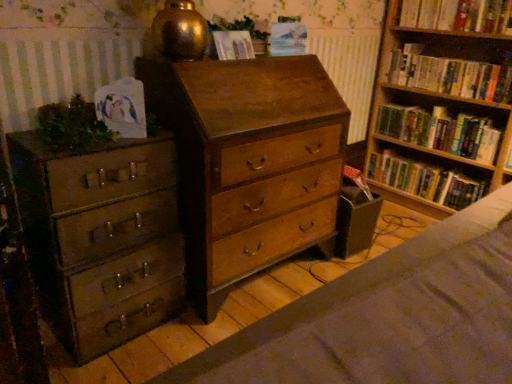
Question: Can you confirm if wooden bookshelf at right, which ranks as the third book in top-to-bottom order, is positioned to the right of green matte plant at left, arranged as the 1th plant when ordered from the bottom?

Choices:
 (A) yes
 (B) no

Answer: (A)

Question: Are wooden bookshelf at right, which ranks as the third book in top-to-bottom order, and green matte plant at left, positioned as the 1th plant in front-to-back order, making contact?

Choices:
 (A) no
 (B) yes

Answer: (A)

Question: Can you confirm if wooden bookshelf at right, which ranks as the third book in top-to-bottom order, is wider than green matte plant at left, marked as the second plant in a top-to-bottom arrangement?

Choices:
 (A) yes
 (B) no

Answer: (A)

Question: Would you say wooden bookshelf at right, the 2th book in the bottom-to-top sequence, contains green matte plant at left, arranged as the second plant when viewed from the back?

Choices:
 (A) yes
 (B) no

Answer: (B)

Question: Is wooden bookshelf at right, which ranks as the third book in top-to-bottom order, not inside green matte plant at left, marked as the second plant in a top-to-bottom arrangement?

Choices:
 (A) yes
 (B) no

Answer: (A)

Question: Considering the relative positions of wooden bookshelf at right, which ranks as the third book in top-to-bottom order, and matte green metal chest of drawers at left, the 2th chest of drawers when ordered from right to left, in the image provided, is wooden bookshelf at right, which ranks as the third book in top-to-bottom order, to the left or to the right of matte green metal chest of drawers at left, the 2th chest of drawers when ordered from right to left,?

Choices:
 (A) left
 (B) right

Answer: (B)

Question: From the image's perspective, relative to matte green metal chest of drawers at left, the 1th chest of drawers in the left-to-right sequence, is wooden bookshelf at right, the 2th book in the bottom-to-top sequence, above or below?

Choices:
 (A) below
 (B) above

Answer: (B)

Question: From their relative heights in the image, would you say wooden bookshelf at right, the 2th book in the bottom-to-top sequence, is taller or shorter than matte green metal chest of drawers at left, the 1th chest of drawers in the left-to-right sequence?

Choices:
 (A) tall
 (B) short

Answer: (B)

Question: Would you say wooden bookshelf at right, which ranks as the third book in top-to-bottom order, is inside or outside matte green metal chest of drawers at left, the 1th chest of drawers in the left-to-right sequence?

Choices:
 (A) outside
 (B) inside

Answer: (A)

Question: Would you say wooden chest of drawers at center, the first chest of drawers when ordered from right to left, is to the left or to the right of hardcover book at right, the 1th book positioned from the bottom, in the picture?

Choices:
 (A) right
 (B) left

Answer: (B)

Question: Considering their positions, is wooden chest of drawers at center, acting as the second chest of drawers starting from the left, located in front of or behind hardcover book at right, the fourth book viewed from the top?

Choices:
 (A) front
 (B) behind

Answer: (A)

Question: Looking at their shapes, would you say wooden chest of drawers at center, the first chest of drawers when ordered from right to left, is wider or thinner than hardcover book at right, the 1th book positioned from the bottom?

Choices:
 (A) thin
 (B) wide

Answer: (B)

Question: Would you say wooden chest of drawers at center, the first chest of drawers when ordered from right to left, is inside or outside hardcover book at right, the 1th book positioned from the bottom?

Choices:
 (A) outside
 (B) inside

Answer: (A)

Question: Is wooden chest of drawers at center, acting as the second chest of drawers starting from the left, inside or outside of hardcover books at right, which is the second book in top-to-bottom order?

Choices:
 (A) inside
 (B) outside

Answer: (B)

Question: Considering the relative positions of wooden chest of drawers at center, the first chest of drawers when ordered from right to left, and hardcover books at right, which is the second book in top-to-bottom order, in the image provided, is wooden chest of drawers at center, the first chest of drawers when ordered from right to left, to the left or to the right of hardcover books at right, which is the second book in top-to-bottom order,?

Choices:
 (A) right
 (B) left

Answer: (B)